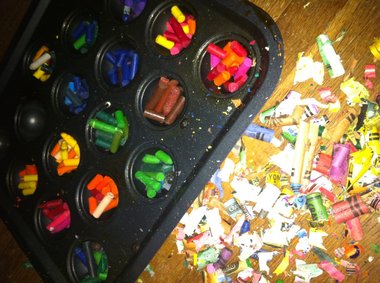
I want to click on table, so click(x=346, y=22).